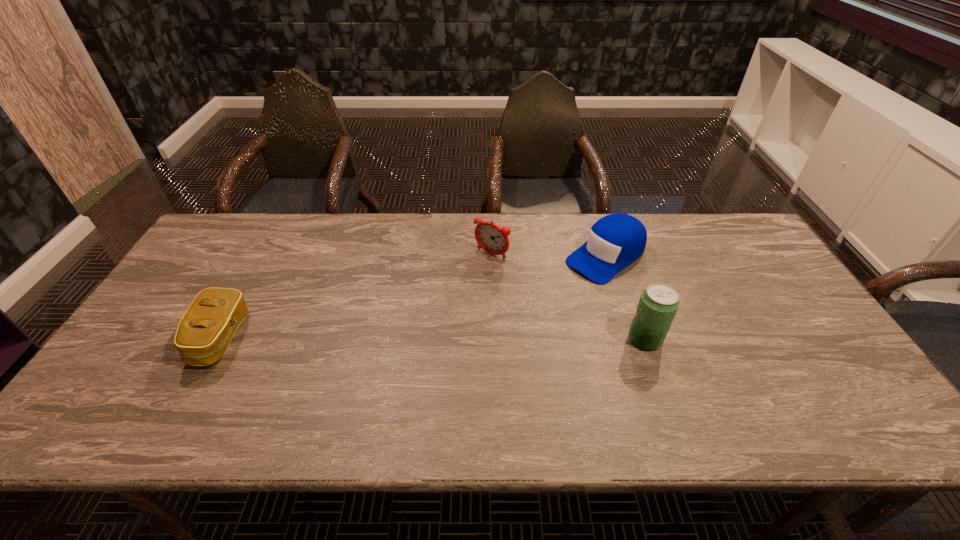
At what (x,y) coordinates should I click in order to perform the action: click on the leftmost object. Please return your answer as a coordinate pair (x, y). Image resolution: width=960 pixels, height=540 pixels. Looking at the image, I should click on (204, 333).

The image size is (960, 540). In order to click on the tallest object in this screenshot , I will do `click(659, 302)`.

Find the location of a particular element. The height and width of the screenshot is (540, 960). baseball cap is located at coordinates (615, 241).

You are a GUI agent. You are given a task and a screenshot of the screen. Output one action in this format:
    pyautogui.click(x=<x>, y=<y>)
    Task: Click on the alarm clock
    
    Given the screenshot: What is the action you would take?
    pyautogui.click(x=493, y=239)

Identify the location of vacant space located on the zipper side of the clutch bag. (174, 339).

Where is `free space located on the zipper side of the clutch bag`? Image resolution: width=960 pixels, height=540 pixels. free space located on the zipper side of the clutch bag is located at coordinates (147, 339).

Where is `free space located 0.160m on the zipper side of the clutch bag`? This screenshot has width=960, height=540. free space located 0.160m on the zipper side of the clutch bag is located at coordinates (135, 339).

You are a GUI agent. You are given a task and a screenshot of the screen. Output one action in this format:
    pyautogui.click(x=<x>, y=<y>)
    Task: Click on the vacant space located 0.050m on the right of the soda
    This screenshot has height=540, width=960.
    Given the screenshot: What is the action you would take?
    pyautogui.click(x=682, y=339)

This screenshot has height=540, width=960. I want to click on blank space located on the front-facing side of the baseball cap, so click(x=515, y=320).

This screenshot has width=960, height=540. I want to click on free region located 0.230m on the front-facing side of the baseball cap, so click(525, 313).